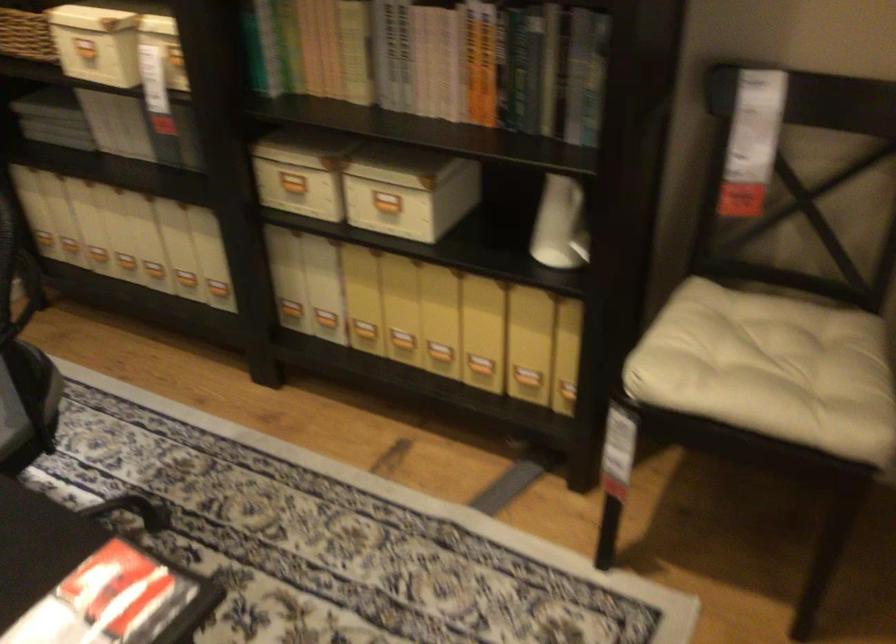
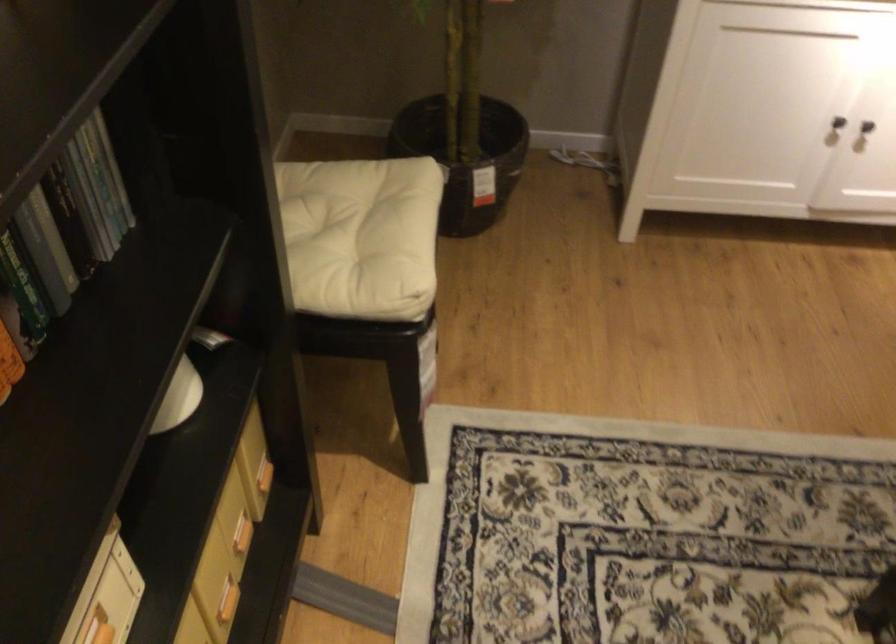
Where in the second image is the point corresponding to point 504,362 from the first image?

(227, 601)